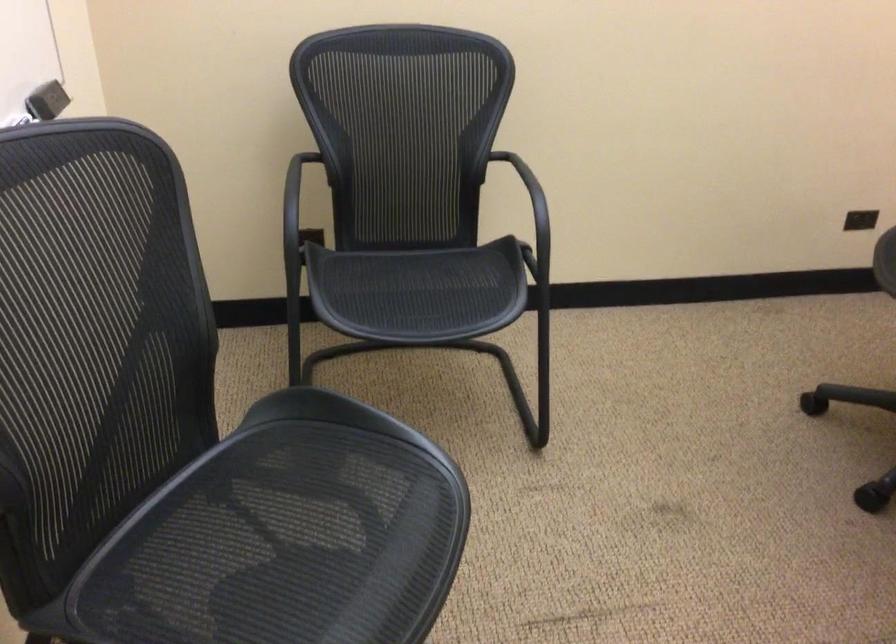
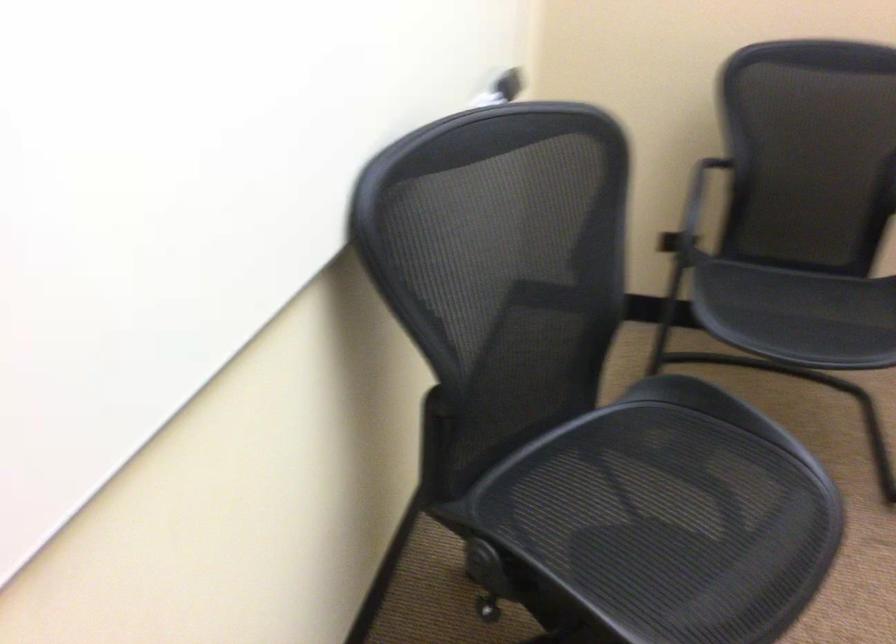
Where in the second image is the point corresponding to [256,540] from the first image?

(634, 502)